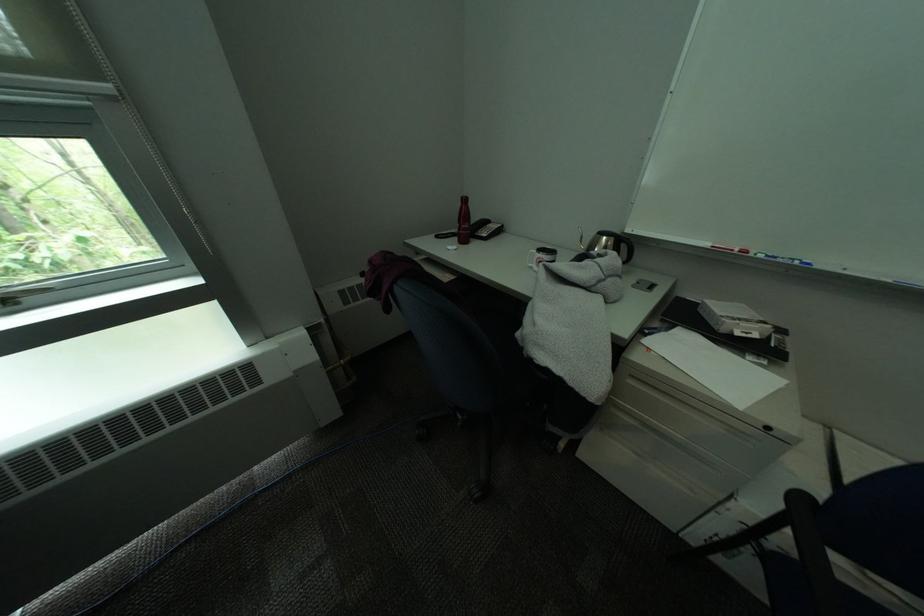
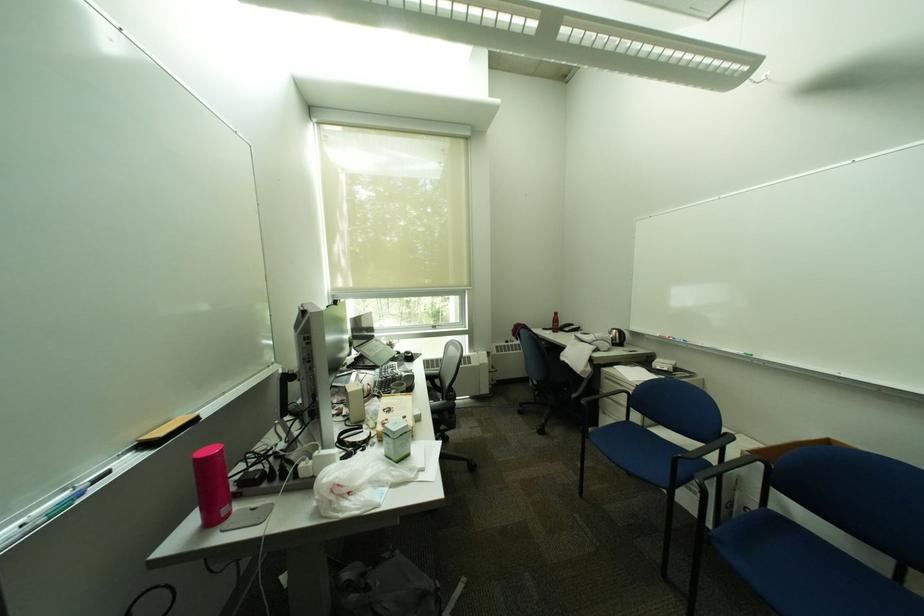
Locate, in the second image, the point that corresponds to point (621, 281) in the first image.

(611, 342)